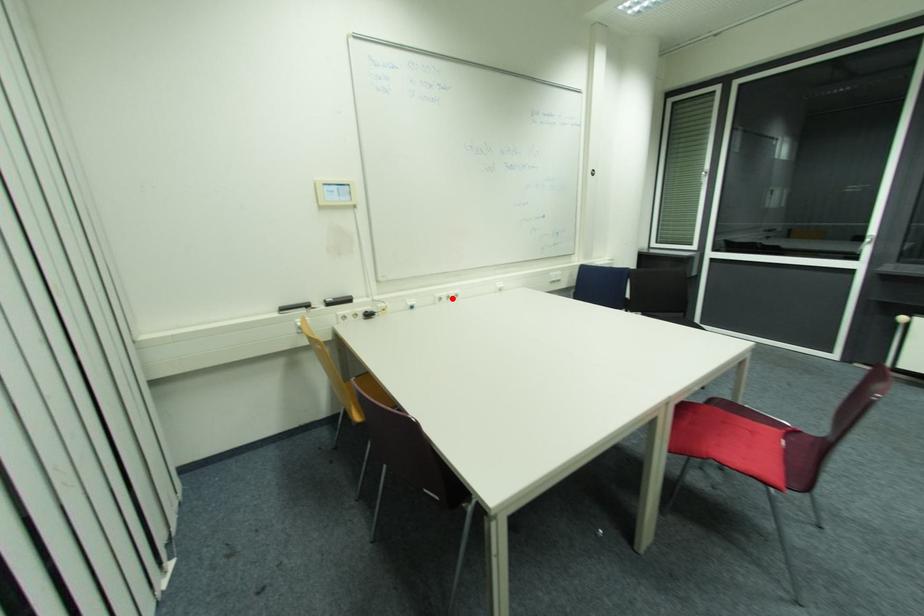
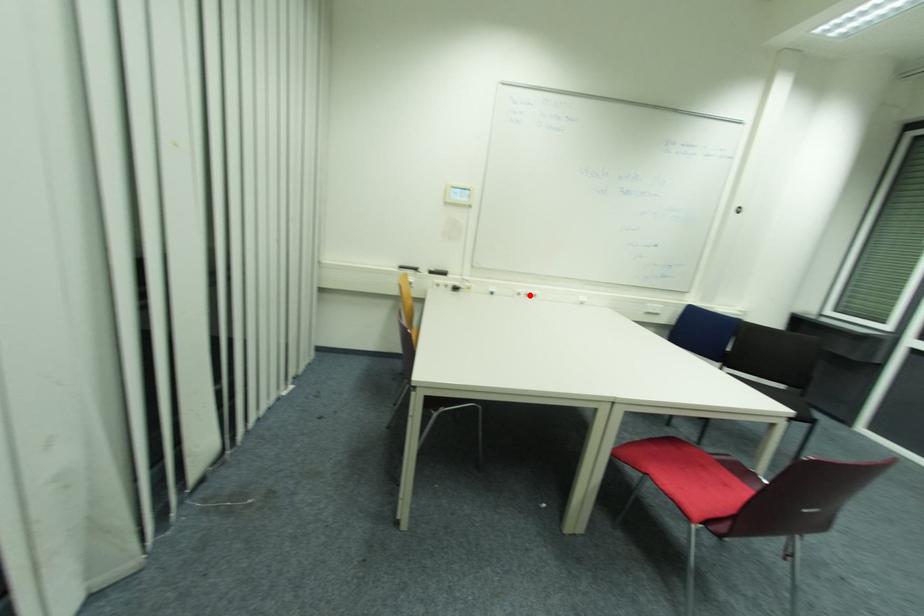
I am providing you with two images of the same scene from different viewpoints. A red point is marked on the first image and another point is marked on the second image. Are the points marked in image1 and image2 representing the same 3D position?

Yes